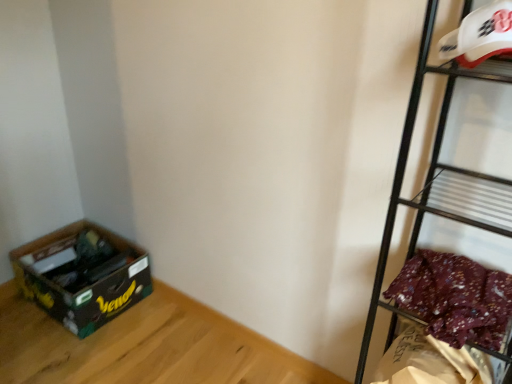
Locate an element on the screen. free space in front of green cardboard box at lower left is located at coordinates (64, 351).